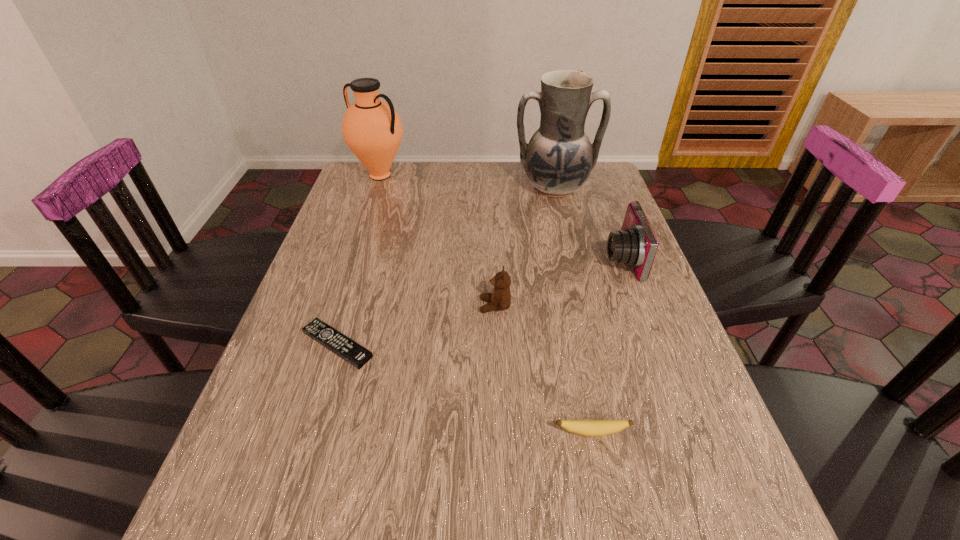
The image size is (960, 540). I want to click on vacant area situated 0.290m on the front-facing side of the camera, so click(x=492, y=258).

Locate an element on the screen. Image resolution: width=960 pixels, height=540 pixels. vacant region located 0.100m on the front-facing side of the camera is located at coordinates (565, 258).

Identify the location of free space located on the front-facing side of the camera. (512, 258).

This screenshot has height=540, width=960. Find the location of `blank space located at the face of the fourth object from right to left`. blank space located at the face of the fourth object from right to left is located at coordinates (442, 306).

Where is `free region located 0.270m at the face of the fourth object from right to left`? free region located 0.270m at the face of the fourth object from right to left is located at coordinates (364, 306).

Locate an element on the screen. free location located 0.340m at the face of the fourth object from right to left is located at coordinates (334, 306).

I want to click on vacant region located on the back of the fifth tallest object, so click(567, 311).

Identify the location of vacant space located on the right of the shortest object. (479, 345).

Locate an element on the screen. This screenshot has height=540, width=960. pitcher positioned at the left edge is located at coordinates (372, 129).

This screenshot has height=540, width=960. What are the coordinates of `remote control that is at the left edge` in the screenshot? It's located at (344, 347).